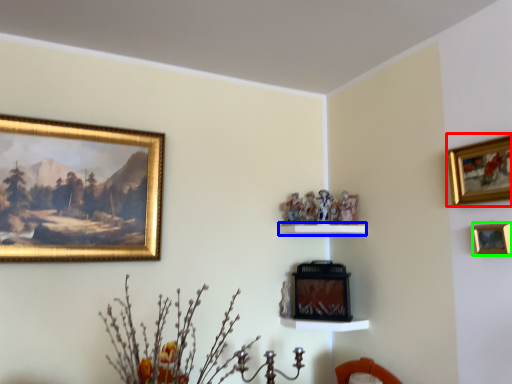
Question: Which is nearer to the picture frame (highlighted by a red box)? shelf (highlighted by a blue box) or picture frame (highlighted by a green box).

Choices:
 (A) shelf
 (B) picture frame

Answer: (B)